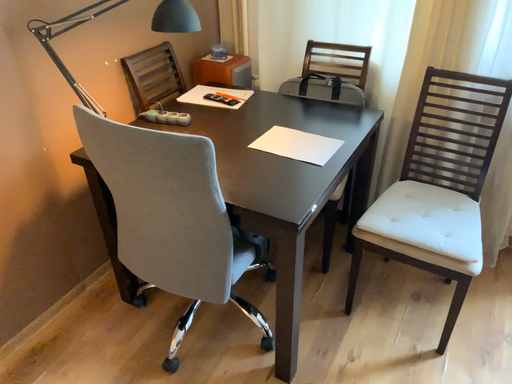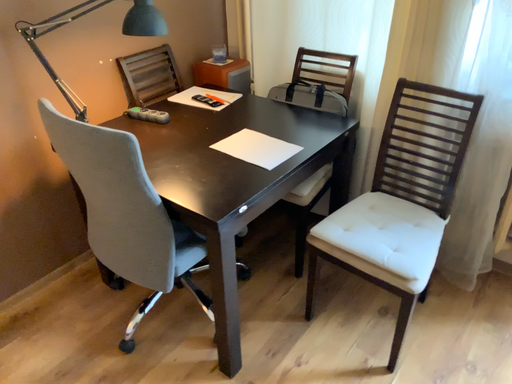
Question: Which way did the camera rotate in the video?

Choices:
 (A) rotated right
 (B) rotated left

Answer: (B)